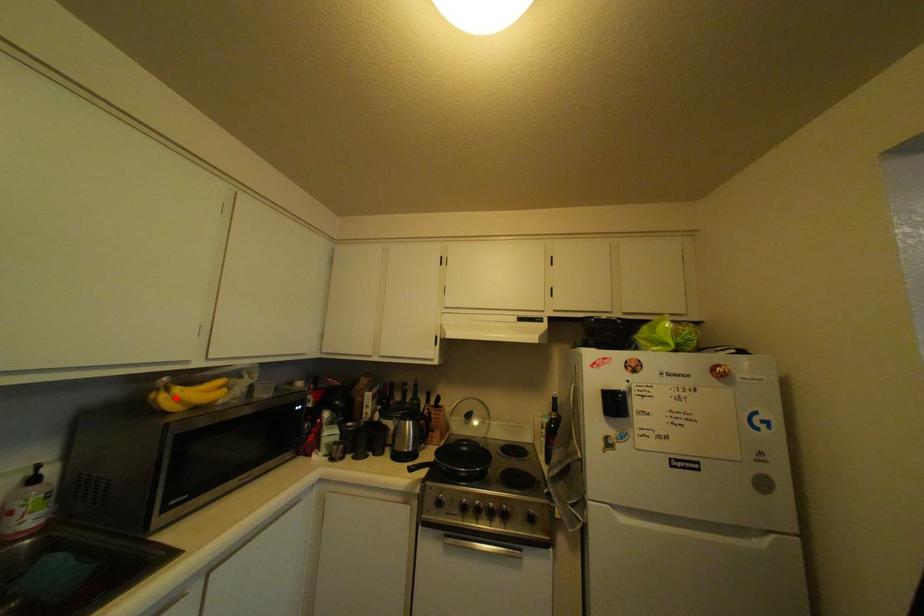
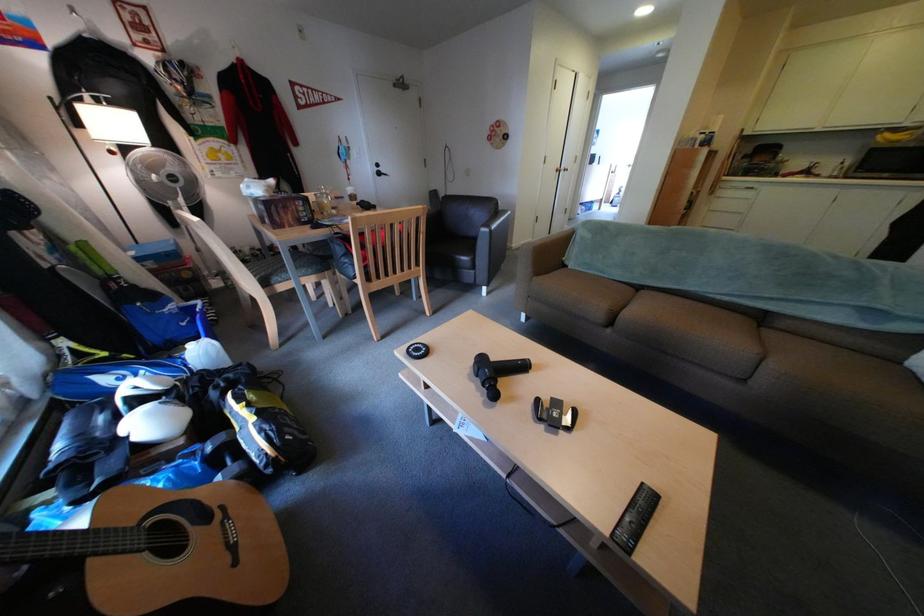
In the second image, find the point that corresponds to the highlighted location in the first image.

(894, 138)